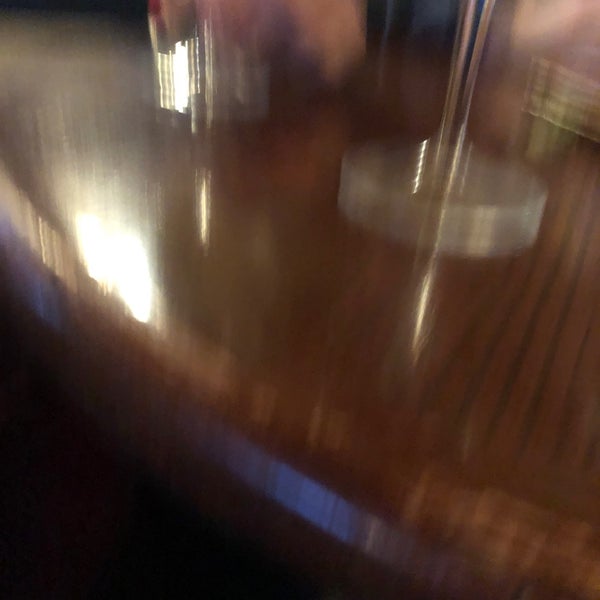
You are a GUI agent. You are given a task and a screenshot of the screen. Output one action in this format:
    pyautogui.click(x=<x>, y=<y>)
    Task: Click on the wood grain
    
    Given the screenshot: What is the action you would take?
    pyautogui.click(x=509, y=373), pyautogui.click(x=480, y=375), pyautogui.click(x=535, y=397)